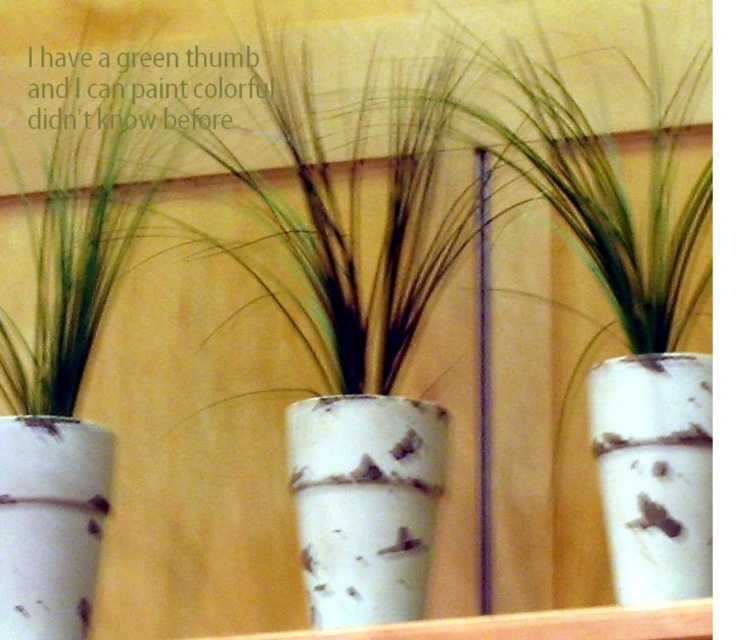
In the scene shown: You are arranging flowers in a room and need to place a new vase between the existing vases. The current setup has a white speckled vase at center. Where should you position the new vase to maintain symmetry with the existing arrangement?

To maintain symmetry with the existing arrangement, the new vase should be placed equidistant from the white speckled vase at center as the other vases, ensuring balanced positioning on either side.

You are arranging plants on a shelf and want to ensure they are stable. Given the white speckled vase at center and the white textured vase at center, which one should you place at the bottom to prevent tipping?

The white speckled vase at center is shorter than the white textured vase at center, so placing the taller white textured vase at center on the bottom would provide a more stable base.

You are standing in front of three white vases arranged side by side on a wooden surface. You notice a specific point marked at coordinates [654,472]. Which of the vases is positioned exactly at this point?

The white textured vase at center is positioned exactly at point [654,472].